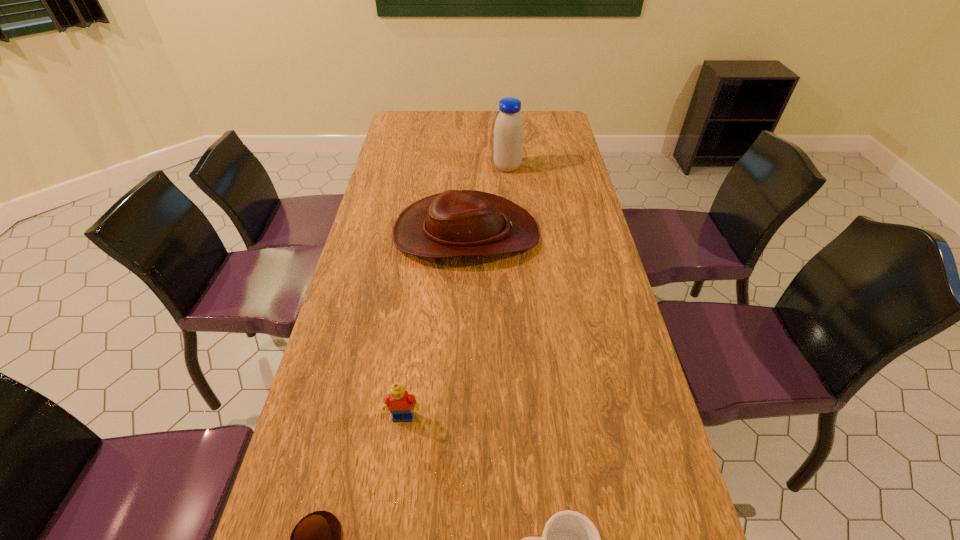
Identify the location of soya milk. (509, 127).

This screenshot has width=960, height=540. In order to click on the tallest object in this screenshot , I will do click(509, 127).

Locate an element on the screen. Image resolution: width=960 pixels, height=540 pixels. the fourth nearest object is located at coordinates (455, 223).

Locate an element on the screen. The image size is (960, 540). the third nearest object is located at coordinates 399,402.

This screenshot has height=540, width=960. Identify the location of vacant point located 0.370m on the front of the soya milk. tap(514, 240).

Find the location of `free space located 0.110m on the front-facing side of the cowboy hat`. free space located 0.110m on the front-facing side of the cowboy hat is located at coordinates (574, 234).

Find the location of `free space located 0.190m on the face of the third farthest object`. free space located 0.190m on the face of the third farthest object is located at coordinates (390, 520).

What are the coordinates of `object positioned at the left edge` in the screenshot? It's located at (455, 223).

In the image, there is a desktop. Where is `vacant space at the far edge`? vacant space at the far edge is located at coordinates (526, 119).

In the image, there is a desktop. Identify the location of free space at the left edge. The height and width of the screenshot is (540, 960). (351, 513).